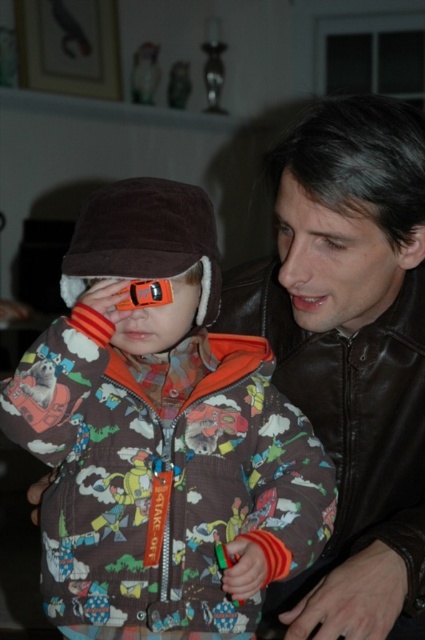
You are a delivery person who needs to place a small package between the brown fleece jacket at center and the orange plastic goggles at left. The package is 20 centimeters long. Can you fit it between them without moving either object?

The distance between the brown fleece jacket at center and the orange plastic goggles at left is 25.60 centimeters. Since the package is 20 centimeters long, it can fit between them as there is enough space.

Based on the photo, you are a tailor measuring garments for a customer. You observe the brown fleece jacket at center and the brown fuzzy hat at upper left. Which item requires more fabric to produce?

The brown fleece jacket at center requires more fabric to produce because it has a larger size compared to the brown fuzzy hat at upper left.